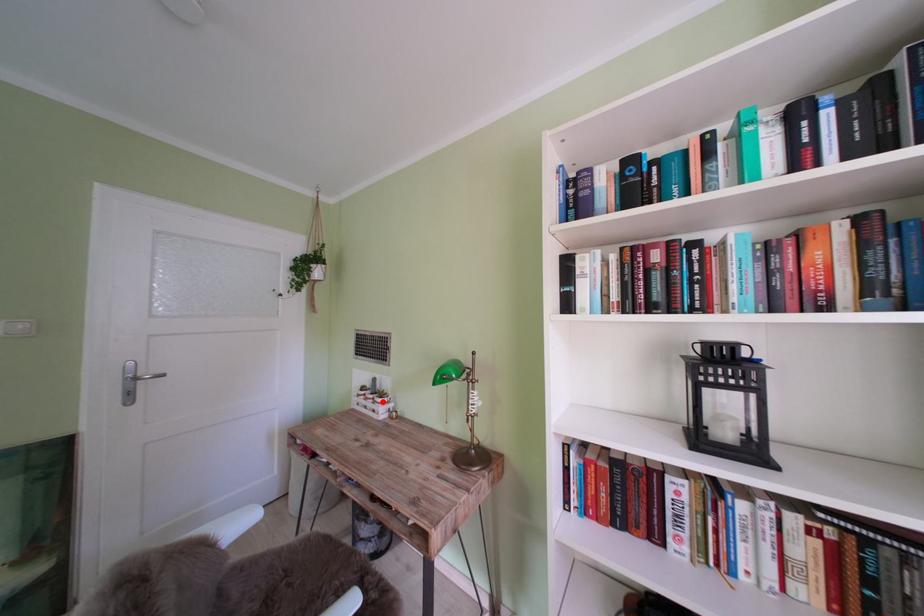
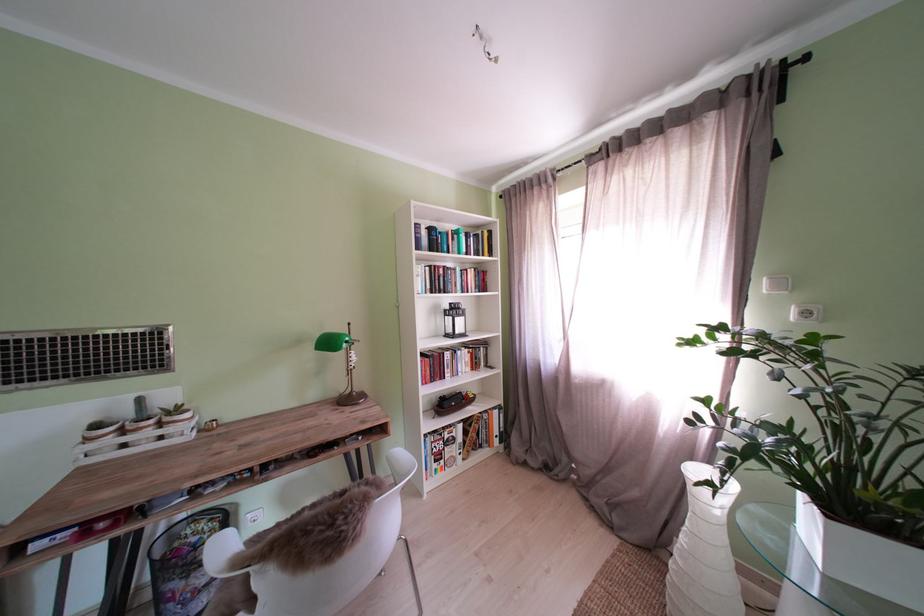
In the second image, find the point that corresponds to the highlighted location in the first image.

(163, 427)